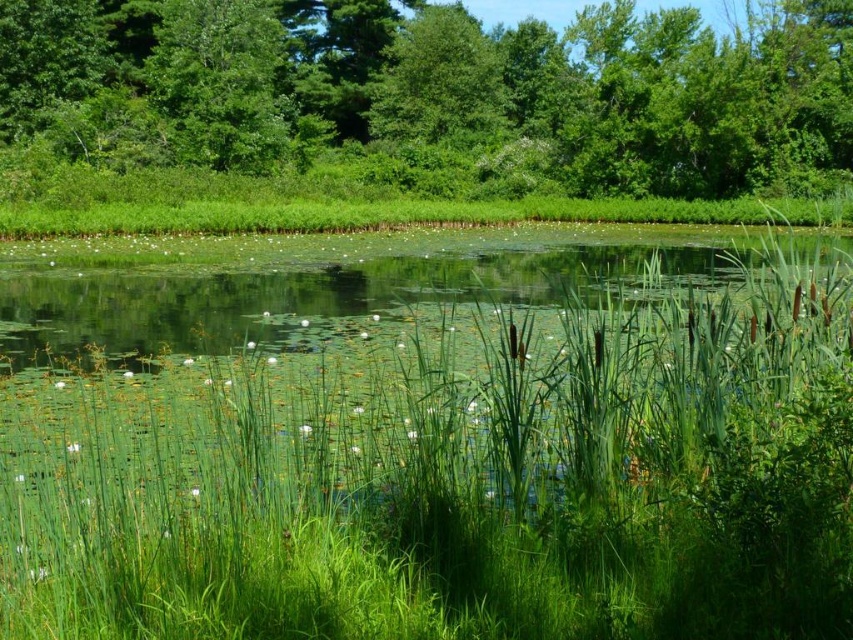
Question: Which object is closer to the camera taking this photo?

Choices:
 (A) green leafy tree at upper center
 (B) green grass at center

Answer: (B)

Question: Does green grass at center appear on the right side of green leafy tree at upper center?

Choices:
 (A) yes
 (B) no

Answer: (A)

Question: Among these points, which one is farthest from the camera?

Choices:
 (A) (432, 541)
 (B) (705, 99)

Answer: (B)

Question: Does green grass at center have a larger size compared to green leafy tree at upper center?

Choices:
 (A) yes
 (B) no

Answer: (B)

Question: Which point is farther to the camera?

Choices:
 (A) (222, 476)
 (B) (759, 28)

Answer: (B)

Question: Is green grass at center positioned at the back of green leafy tree at upper center?

Choices:
 (A) no
 (B) yes

Answer: (A)